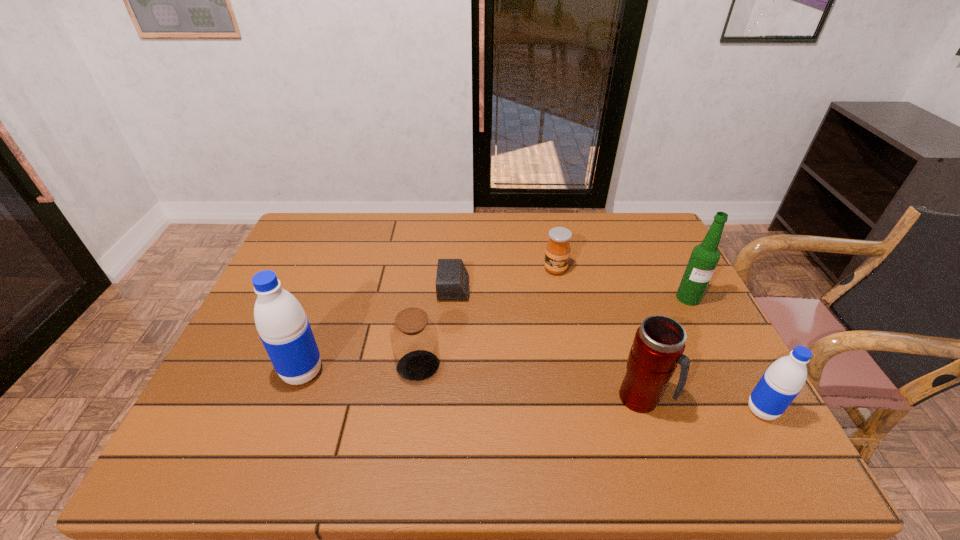
This screenshot has height=540, width=960. What are the coordinates of `blank area located on the back of the taller water bottle` in the screenshot? It's located at (316, 337).

You are a GUI agent. You are given a task and a screenshot of the screen. Output one action in this format:
    pyautogui.click(x=<x>, y=<y>)
    Task: Click on the vacant space located 0.320m on the back of the shorter water bottle
    
    Given the screenshot: What is the action you would take?
    pyautogui.click(x=702, y=300)

At what (x,y) coordinates should I click in order to perform the action: click on vacant region located 0.130m on the front-facing side of the shortest object. Please return your answer as a coordinate pair (x, y). Image resolution: width=960 pixels, height=540 pixels. Looking at the image, I should click on coord(515,289).

Where is `free space located 0.350m on the front-facing side of the second shortest object`? free space located 0.350m on the front-facing side of the second shortest object is located at coordinates point(576,373).

Find the location of `free point located on the label of the beer bottle`. free point located on the label of the beer bottle is located at coordinates (751, 419).

The image size is (960, 540). What are the coordinates of `free space located on the side with the handle of the thermos bottle` in the screenshot? It's located at (713, 399).

The image size is (960, 540). In order to click on vacant region located on the back of the third shortest object in this screenshot , I will do `click(429, 288)`.

In order to click on thermos bottle that is at the near edge in this screenshot , I will do `click(658, 346)`.

You are a GUI agent. You are given a task and a screenshot of the screen. Output one action in this format:
    pyautogui.click(x=<x>, y=<y>)
    Task: Click on the object at the left edge
    
    Given the screenshot: What is the action you would take?
    pyautogui.click(x=284, y=329)

The width and height of the screenshot is (960, 540). Find the location of `water bottle that is positioned at the right edge`. water bottle that is positioned at the right edge is located at coordinates (780, 384).